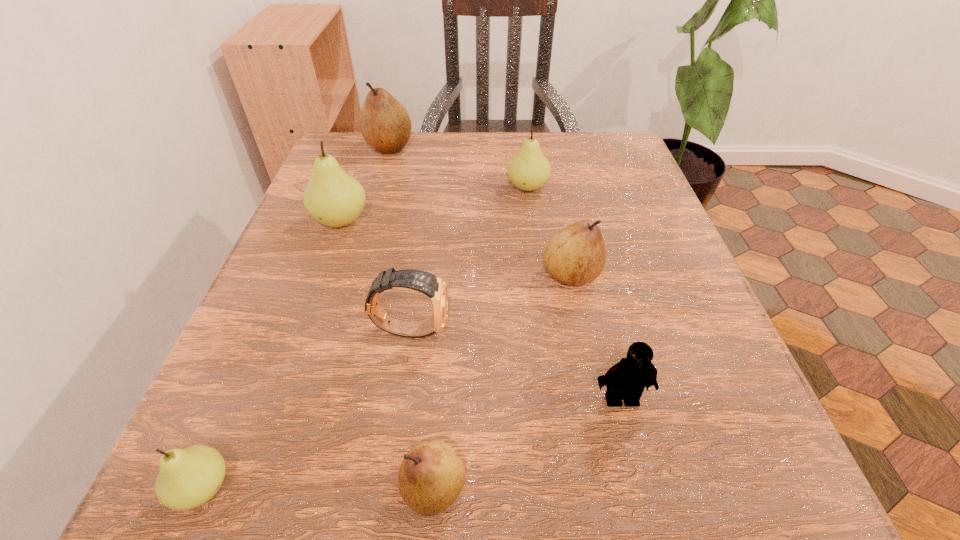
Where is `free space located 0.120m on the face of the Lego`? free space located 0.120m on the face of the Lego is located at coordinates (648, 507).

Locate an element on the screen. The image size is (960, 540). free space located on the right of the smallest green pear is located at coordinates (397, 488).

At what (x,y) coordinates should I click in order to perform the action: click on free space located on the right of the smallest brown pear. Please return your answer as a coordinate pair (x, y). This screenshot has height=540, width=960. Looking at the image, I should click on (780, 488).

Where is `pear that is at the right edge`? The width and height of the screenshot is (960, 540). pear that is at the right edge is located at coordinates (576, 254).

Where is `Lego that is at the right edge`? The width and height of the screenshot is (960, 540). Lego that is at the right edge is located at coordinates pyautogui.click(x=626, y=380).

Where is `object that is at the far left corner`? This screenshot has width=960, height=540. object that is at the far left corner is located at coordinates (385, 124).

Where is `object that is at the near left corner`? This screenshot has width=960, height=540. object that is at the near left corner is located at coordinates (187, 478).

Identify the location of vacant space at the far edge of the desktop. (434, 151).

This screenshot has width=960, height=540. In order to click on vacant region at the near edge of the desktop in this screenshot , I will do `click(313, 512)`.

The image size is (960, 540). I want to click on free region at the right edge of the desktop, so click(x=663, y=240).